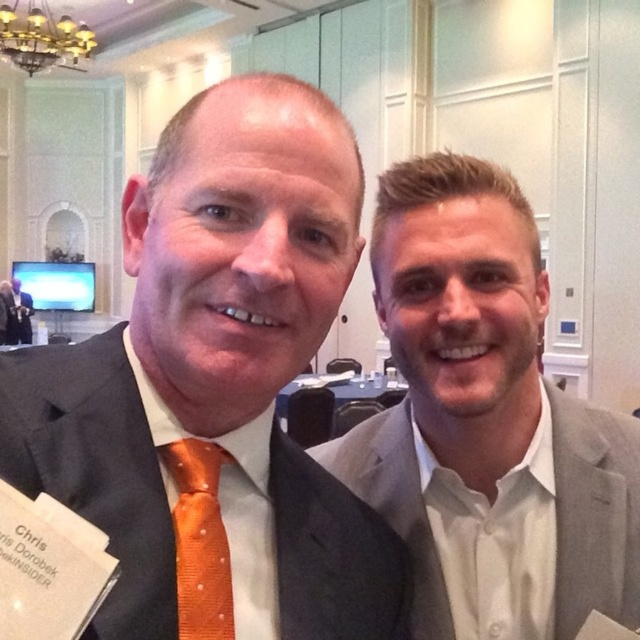
Is gray fabric suit at right wider than orange dotted fabric tie at left?

Indeed, gray fabric suit at right has a greater width compared to orange dotted fabric tie at left.

Find the location of a particular element. gray fabric suit at right is located at coordinates (486, 422).

Identify the location of gray fabric suit at right. (486, 422).

Looking at this image, does gray fabric suit at right have a greater width compared to matte black suit at center?

Yes.

Measure the distance between point (620,577) and camera.

The distance of point (620,577) from camera is 30.03 inches.

Who is more forward, (563, 406) or (17, 300)?

Point (563, 406) is in front.

I want to click on gray fabric suit at right, so click(x=486, y=422).

Can you confirm if orange silk tie at center is positioned to the right of matte black suit at center?

Correct, you'll find orange silk tie at center to the right of matte black suit at center.

Based on the photo, does orange silk tie at center lie behind matte black suit at center?

No, it is not.

What do you see at coordinates (216, 387) in the screenshot? I see `orange silk tie at center` at bounding box center [216, 387].

This screenshot has width=640, height=640. Identify the location of orange silk tie at center. (216, 387).